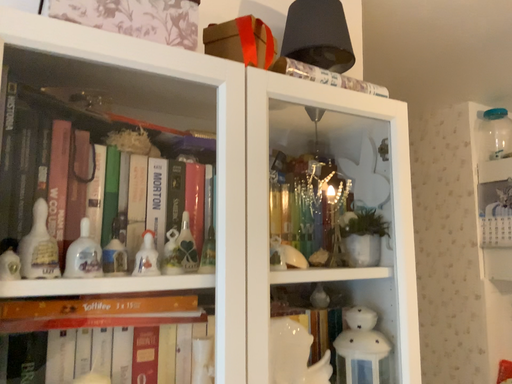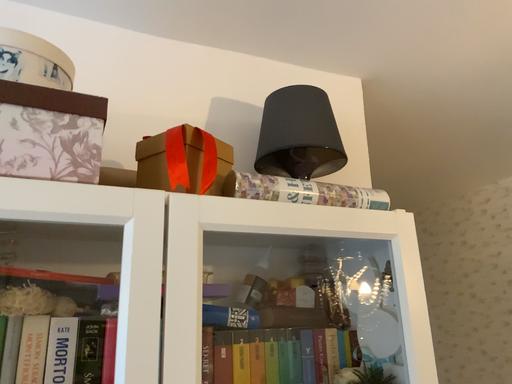
Question: Which way did the camera rotate in the video?

Choices:
 (A) rotated upward
 (B) rotated downward

Answer: (A)